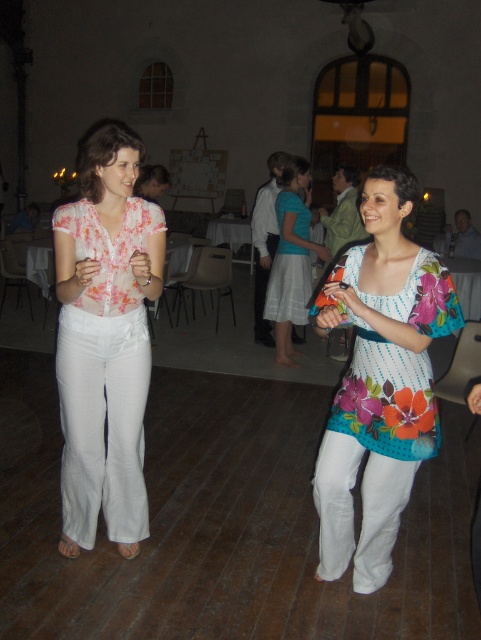
Is floral fabric blouse at center further to the viewer compared to floral printed blouse at center?

Yes, it is.

From the picture: Between floral fabric blouse at center and floral printed blouse at center, which one appears on the left side from the viewer's perspective?

From the viewer's perspective, floral fabric blouse at center appears more on the left side.

Between point (365, 516) and point (356, 380), which one is positioned in front?

Positioned in front is point (356, 380).

Find the location of a particular element. floral fabric blouse at center is located at coordinates (379, 380).

Can you confirm if white cotton pants at left is wider than floral printed blouse at center?

Correct, the width of white cotton pants at left exceeds that of floral printed blouse at center.

This screenshot has width=481, height=640. What do you see at coordinates (104, 340) in the screenshot?
I see `white cotton pants at left` at bounding box center [104, 340].

Find the location of a particular element. white cotton pants at left is located at coordinates (104, 340).

Identify the location of floral fabric blouse at center. (379, 380).

Which is behind, point (370, 477) or point (304, 273)?

The point (304, 273) is more distant.

Who is more distant from viewer, [364,433] or [291,246]?

The point [291,246] is more distant.

At what (x,y) coordinates should I click in order to perform the action: click on floral fabric blouse at center. Please return your answer as a coordinate pair (x, y). Looking at the image, I should click on (379, 380).